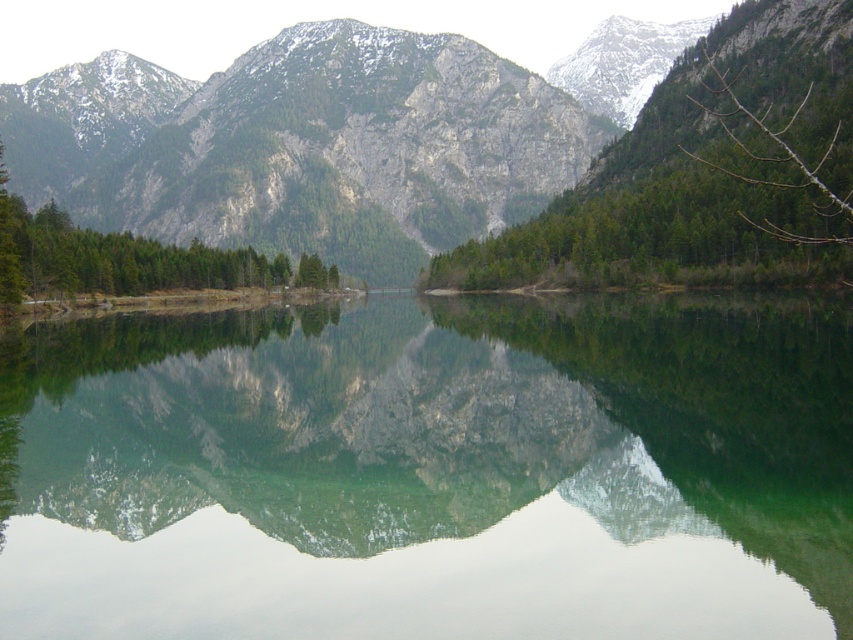
Question: Which object appears farthest from the camera in this image?

Choices:
 (A) green matte tree at center
 (B) green reflective water at center
 (C) green matte tree at left

Answer: (C)

Question: Can you confirm if green matte tree at center is smaller than green matte tree at left?

Choices:
 (A) no
 (B) yes

Answer: (B)

Question: Is green matte tree at center further to camera compared to green matte tree at left?

Choices:
 (A) yes
 (B) no

Answer: (B)

Question: Which point is farther from the camera taking this photo?

Choices:
 (A) (22, 625)
 (B) (154, 282)

Answer: (B)

Question: Among these objects, which one is farthest from the camera?

Choices:
 (A) green matte tree at center
 (B) green matte tree at left

Answer: (B)

Question: Does green matte tree at center appear on the left side of green matte tree at left?

Choices:
 (A) yes
 (B) no

Answer: (B)